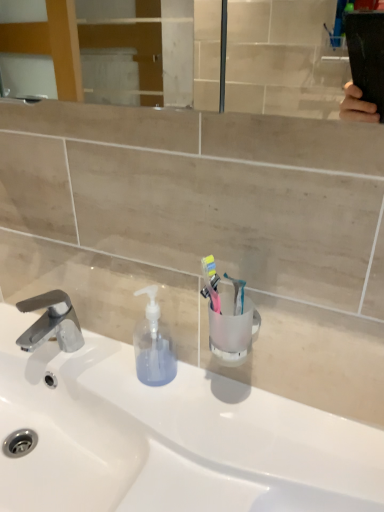
Question: Considering the positions of white glossy sink at center and translucent plastic toothbrush at center, which is counted as the first toothbrush, starting from the left, in the image, is white glossy sink at center bigger or smaller than translucent plastic toothbrush at center, which is counted as the first toothbrush, starting from the left,?

Choices:
 (A) small
 (B) big

Answer: (B)

Question: From a real-world perspective, is white glossy sink at center positioned above or below translucent plastic toothbrush at center, which is counted as the first toothbrush, starting from the left?

Choices:
 (A) below
 (B) above

Answer: (A)

Question: Which is nearer to the chrome metallic faucet at left?

Choices:
 (A) translucent plastic toothbrush at center, the second toothbrush from the left
 (B) transparent plastic soap dispenser at center
 (C) translucent plastic toothbrush at center, which is counted as the first toothbrush, starting from the left
 (D) white glossy sink at center

Answer: (B)

Question: Which is nearer to the white glossy sink at center?

Choices:
 (A) translucent plastic toothbrush at center, the second toothbrush from the left
 (B) translucent plastic toothbrush at center, which appears as the second toothbrush when viewed from the right
 (C) chrome metallic faucet at left
 (D) transparent plastic soap dispenser at center

Answer: (D)